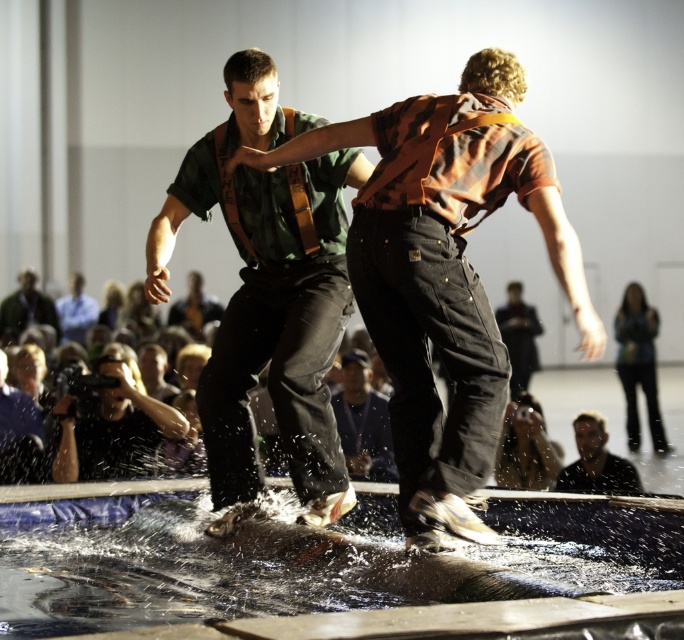
You are a photographer standing at the origin point of the coordinate system. You want to capture the orange cotton shirt at center in your shot. What are the coordinates where you should aim your camera?

The orange cotton shirt at center is located at coordinates 0.428 in the x axis and 0.651 in the y axis, so you should aim your camera at those coordinates to capture it.

You are a costume designer preparing for a performance. You need to ensure that the orange cotton shirt at center and the dark gray fabric pants at center are proportionate. Based on the scene, which of these two items is larger in size?

The orange cotton shirt at center has a larger size compared to the dark gray fabric pants at center, so the orange cotton shirt at center is larger.